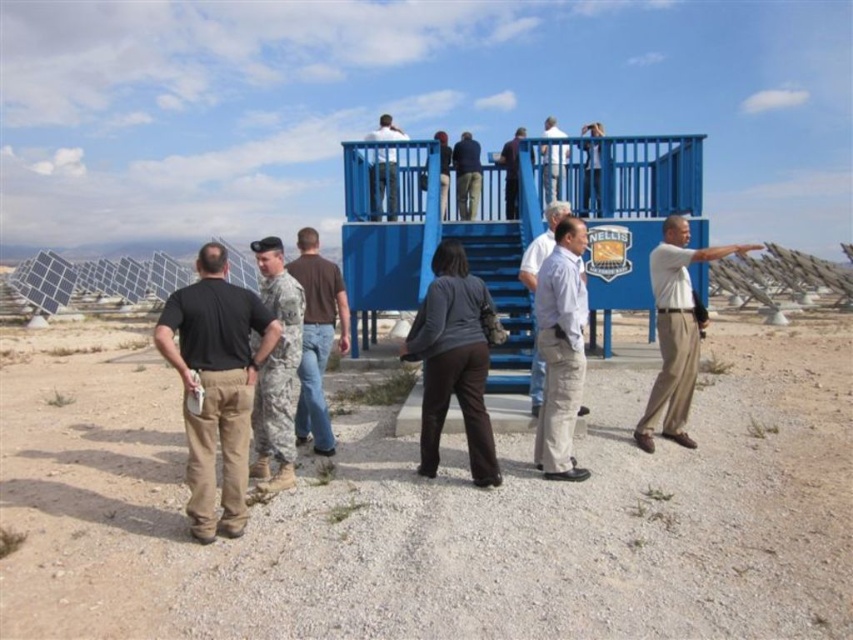
Question: Is dark blue jeans at upper center to the right of dark blue uniform at upper center from the viewer's perspective?

Choices:
 (A) yes
 (B) no

Answer: (A)

Question: Which point is closer to the camera taking this photo?

Choices:
 (A) (396, 204)
 (B) (682, 368)

Answer: (B)

Question: Which object is positioned farthest from the matte white shirt at upper center?

Choices:
 (A) black cotton shirt at center
 (B) white shirt at center

Answer: (A)

Question: Which point is farther from the camera taking this photo?

Choices:
 (A) (386, 173)
 (B) (287, 317)
 (C) (445, 214)
 (D) (407, 348)

Answer: (C)

Question: Does dark gray sweater at center have a larger size compared to camouflage uniform at center?

Choices:
 (A) yes
 (B) no

Answer: (A)

Question: Is dark gray sweater at center to the left of brown cotton shirt at center from the viewer's perspective?

Choices:
 (A) no
 (B) yes

Answer: (A)